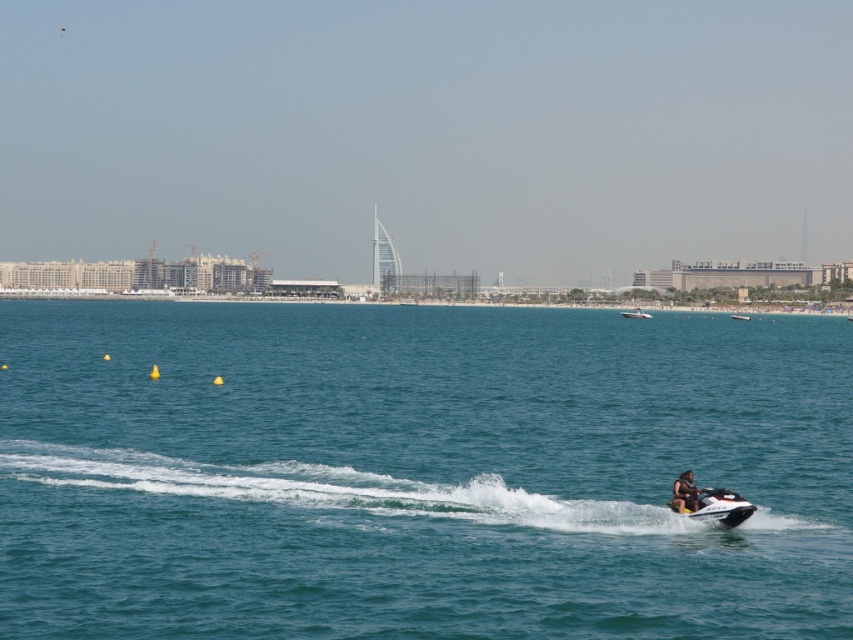
Based on the photo, is clear blue water at center shorter than dark blue fabric life jacket at lower right?

Incorrect, clear blue water at center's height does not fall short of dark blue fabric life jacket at lower right's.

What do you see at coordinates (418, 472) in the screenshot?
I see `clear blue water at center` at bounding box center [418, 472].

Does point (546, 618) come farther from viewer compared to point (685, 500)?

No, it is in front of (685, 500).

At what (x,y) coordinates should I click in order to perform the action: click on clear blue water at center. Please return your answer as a coordinate pair (x, y). Image resolution: width=853 pixels, height=640 pixels. Looking at the image, I should click on (418, 472).

How distant is clear blue water at center from white glossy boat at center?

55.99 meters

Between clear blue water at center and white glossy boat at center, which one appears on the right side from the viewer's perspective?

white glossy boat at center

Find the location of `clear blue water at center`. clear blue water at center is located at coordinates coord(418,472).

Is white glossy boat at center positioned behind metallic silver jet ski at center?

No.

The width and height of the screenshot is (853, 640). Describe the element at coordinates (635, 314) in the screenshot. I see `white glossy boat at center` at that location.

Who is more distant from viewer, (646, 312) or (749, 316)?

Point (646, 312)

Locate an element on the screen. This screenshot has width=853, height=640. white glossy boat at center is located at coordinates (635, 314).